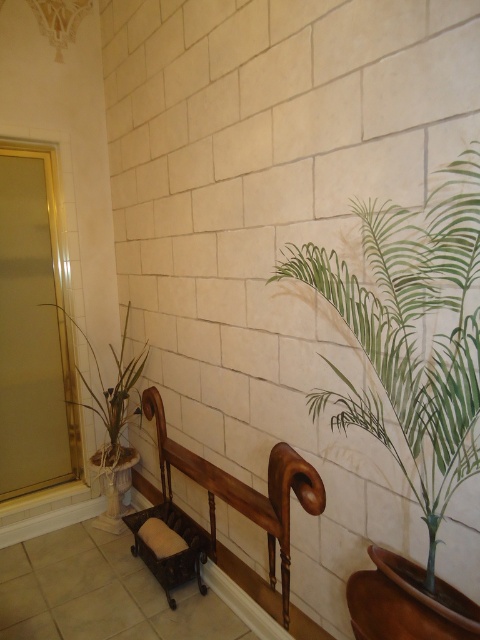
Question: Among these objects, which one is nearest to the camera?

Choices:
 (A) brown polished wood bench at center
 (B) green leafy plant at left

Answer: (A)

Question: Which is farther from the brown polished wood bench at center?

Choices:
 (A) green leafy plant at left
 (B) green leafy plant at right

Answer: (B)

Question: Where is green leafy plant at right located in relation to brown polished wood bench at center in the image?

Choices:
 (A) below
 (B) above

Answer: (B)

Question: Among these objects, which one is nearest to the camera?

Choices:
 (A) green leafy plant at right
 (B) brown polished wood bench at center
 (C) green leafy plant at left

Answer: (A)

Question: Can you confirm if brown polished wood bench at center is bigger than green leafy plant at left?

Choices:
 (A) yes
 (B) no

Answer: (A)

Question: Is brown polished wood bench at center to the right of green leafy plant at left from the viewer's perspective?

Choices:
 (A) yes
 (B) no

Answer: (A)